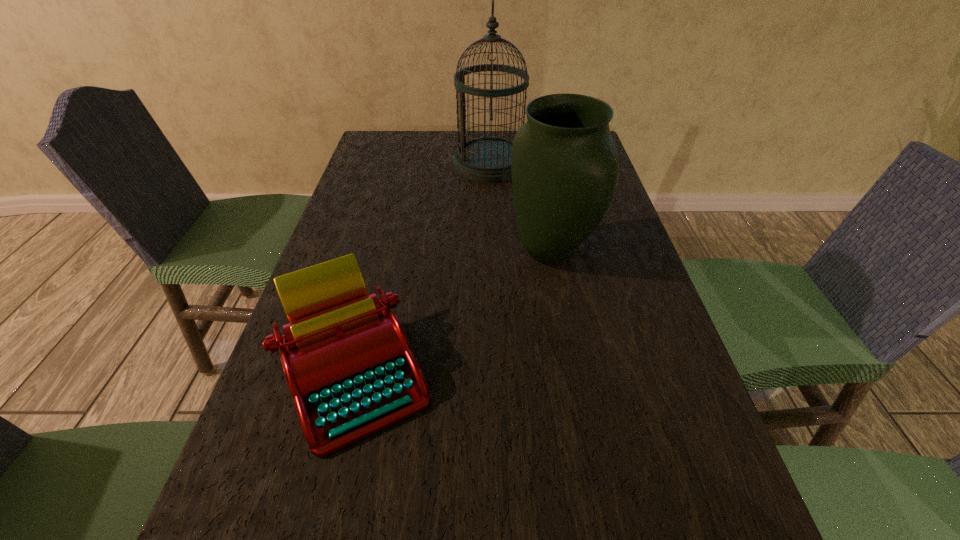
Image resolution: width=960 pixels, height=540 pixels. What are the coordinates of `vacant area that lies between the second farthest object and the shortest object` in the screenshot? It's located at (452, 312).

At what (x,y) coordinates should I click in order to perform the action: click on empty space between the second farthest object and the nearest object. Please return your answer as a coordinate pair (x, y). Looking at the image, I should click on (452, 312).

Where is `object that is the closest to the leftmost object`? This screenshot has width=960, height=540. object that is the closest to the leftmost object is located at coordinates (564, 165).

Identify which object is the second nearest to the nearest object. Please provide its 2D coordinates. Your answer should be formatted as a tuple, i.e. [(x, y)], where the tuple contains the x and y coordinates of a point satisfying the conditions above.

[(487, 159)]

Find the location of a particular element. The width and height of the screenshot is (960, 540). vacant space that satisfies the following two spatial constraints: 1. on the front-facing side of the farthest object; 2. on the typing side of the typewriter is located at coordinates (497, 372).

This screenshot has width=960, height=540. What are the coordinates of `vacant point that satisfies the following two spatial constraints: 1. on the back side of the second nearest object; 2. on the front-facing side of the birdcage` in the screenshot? It's located at (535, 164).